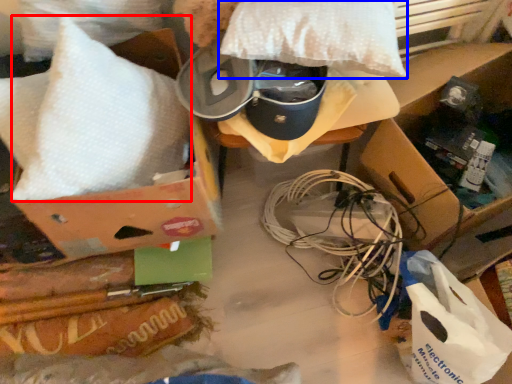
Question: Which object is closer to the camera taking this photo, pillow (highlighted by a red box) or pillow (highlighted by a blue box)?

Choices:
 (A) pillow
 (B) pillow

Answer: (A)